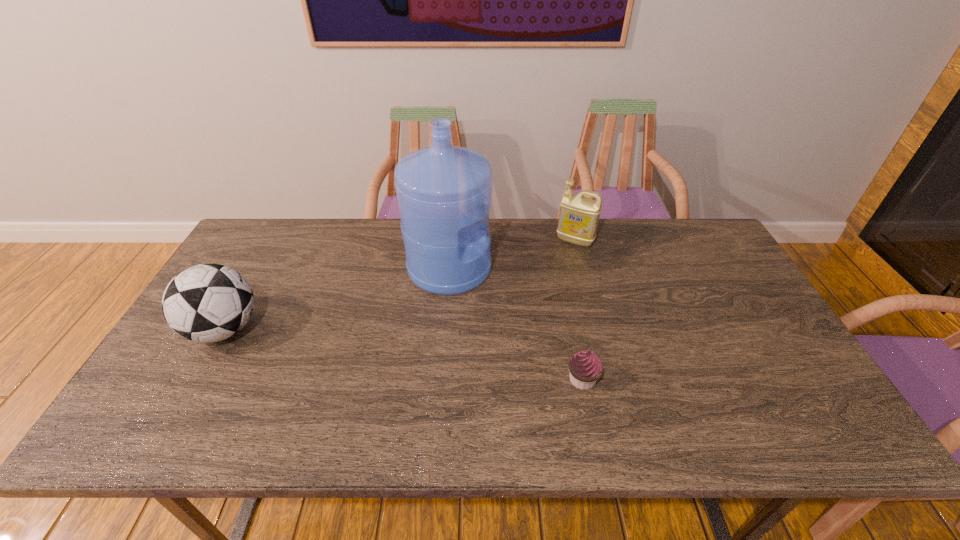
Find the location of a particular element. unoccupied position between the nearest object and the detergent is located at coordinates (579, 310).

Where is `free space between the soccer ball and the detergent`? free space between the soccer ball and the detergent is located at coordinates (399, 285).

What are the coordinates of `free point between the leftmost object and the water jug` in the screenshot? It's located at (337, 299).

The width and height of the screenshot is (960, 540). What are the coordinates of `free spot between the water jug and the soccer ball` in the screenshot? It's located at (337, 299).

Locate an element on the screen. This screenshot has height=540, width=960. unoccupied position between the tallest object and the cupcake is located at coordinates (516, 324).

This screenshot has height=540, width=960. Find the location of `empty location between the tallest object and the detergent`. empty location between the tallest object and the detergent is located at coordinates (512, 254).

Where is `blank region between the leftmost object and the tallest object`? The height and width of the screenshot is (540, 960). blank region between the leftmost object and the tallest object is located at coordinates (337, 299).

Locate an element on the screen. The height and width of the screenshot is (540, 960). unoccupied position between the tallest object and the shortest object is located at coordinates (516, 324).

Where is `unoccupied position between the leftmost object and the detergent`? This screenshot has width=960, height=540. unoccupied position between the leftmost object and the detergent is located at coordinates (399, 285).

I want to click on vacant space in between the leftmost object and the shortest object, so click(403, 354).